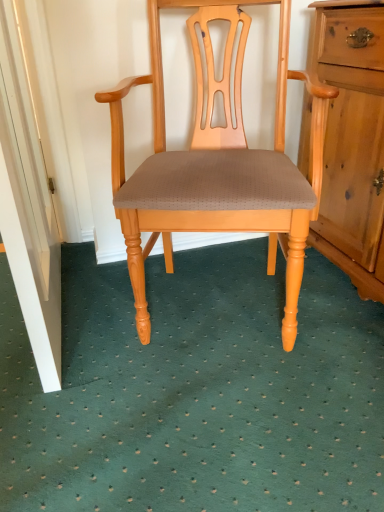
Find the location of a particular element. This screenshot has width=384, height=512. free space in front of white painted wood door at lower left is located at coordinates (91, 409).